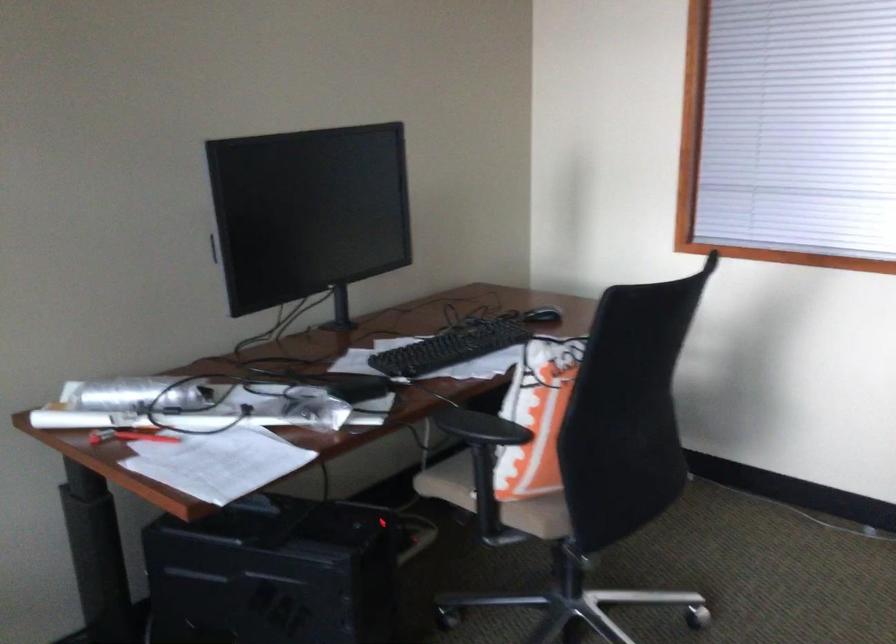
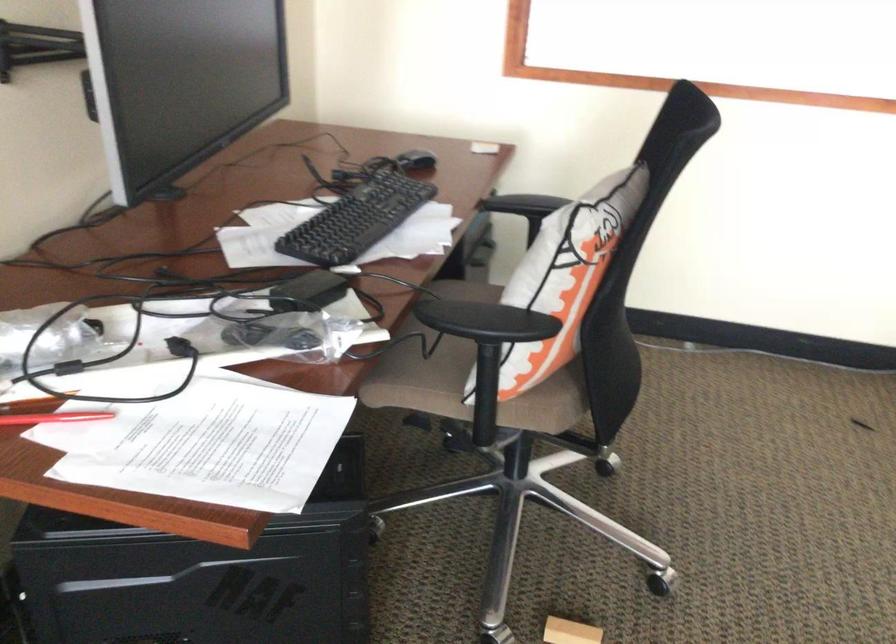
Question: Based on the continuous images, in which direction is the camera rotating? Reply with the corresponding letter.

Choices:
 (A) Left
 (B) Right
 (C) Up
 (D) Down

Answer: (B)